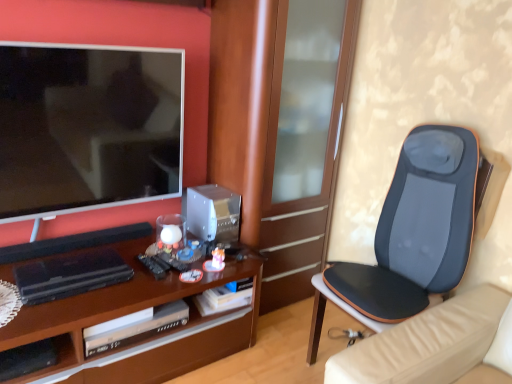
Question: From the image's perspective, does brown wood cabinet at center appear lower than black mesh cushion at right?

Choices:
 (A) no
 (B) yes

Answer: (A)

Question: Can you confirm if brown wood cabinet at center is wider than black mesh cushion at right?

Choices:
 (A) yes
 (B) no

Answer: (B)

Question: Is black mesh cushion at right surrounded by brown wood cabinet at center?

Choices:
 (A) yes
 (B) no

Answer: (B)

Question: Can you confirm if brown wood cabinet at center is thinner than black mesh cushion at right?

Choices:
 (A) no
 (B) yes

Answer: (B)

Question: Is the position of brown wood cabinet at center less distant than that of black mesh cushion at right?

Choices:
 (A) no
 (B) yes

Answer: (A)

Question: Does point (134, 256) appear closer or farther from the camera than point (71, 360)?

Choices:
 (A) closer
 (B) farther

Answer: (B)

Question: From a real-world perspective, is brown wood desk at center positioned above or below black plastic shelf at lower left?

Choices:
 (A) above
 (B) below

Answer: (B)

Question: Considering the positions of brown wood desk at center and black plastic shelf at lower left in the image, is brown wood desk at center wider or thinner than black plastic shelf at lower left?

Choices:
 (A) wide
 (B) thin

Answer: (A)

Question: From their relative heights in the image, would you say brown wood desk at center is taller or shorter than black plastic shelf at lower left?

Choices:
 (A) tall
 (B) short

Answer: (A)

Question: Visually, is black plastic shelf at lower left positioned to the left or to the right of brown wood cabinet at center?

Choices:
 (A) left
 (B) right

Answer: (A)

Question: Looking at the image, does black plastic shelf at lower left seem bigger or smaller compared to brown wood cabinet at center?

Choices:
 (A) small
 (B) big

Answer: (A)

Question: Is point (59, 342) positioned closer to the camera than point (326, 168)?

Choices:
 (A) closer
 (B) farther

Answer: (A)

Question: Would you say black plastic shelf at lower left is inside or outside brown wood cabinet at center?

Choices:
 (A) outside
 (B) inside

Answer: (A)

Question: From a real-world perspective, is matte black tv at left physically located above or below brown wood desk at center?

Choices:
 (A) above
 (B) below

Answer: (A)

Question: Does point (79, 190) appear closer or farther from the camera than point (94, 236)?

Choices:
 (A) closer
 (B) farther

Answer: (A)